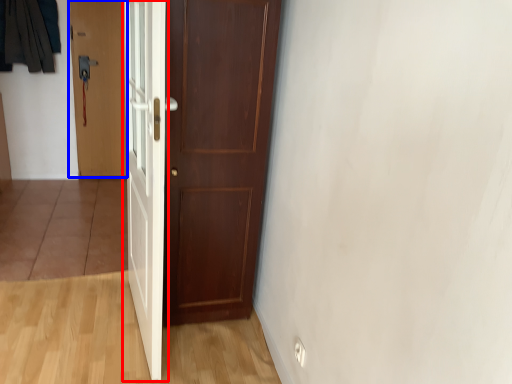
Question: Among these objects, which one is farthest to the camera, door (highlighted by a red box) or door (highlighted by a blue box)?

Choices:
 (A) door
 (B) door

Answer: (B)